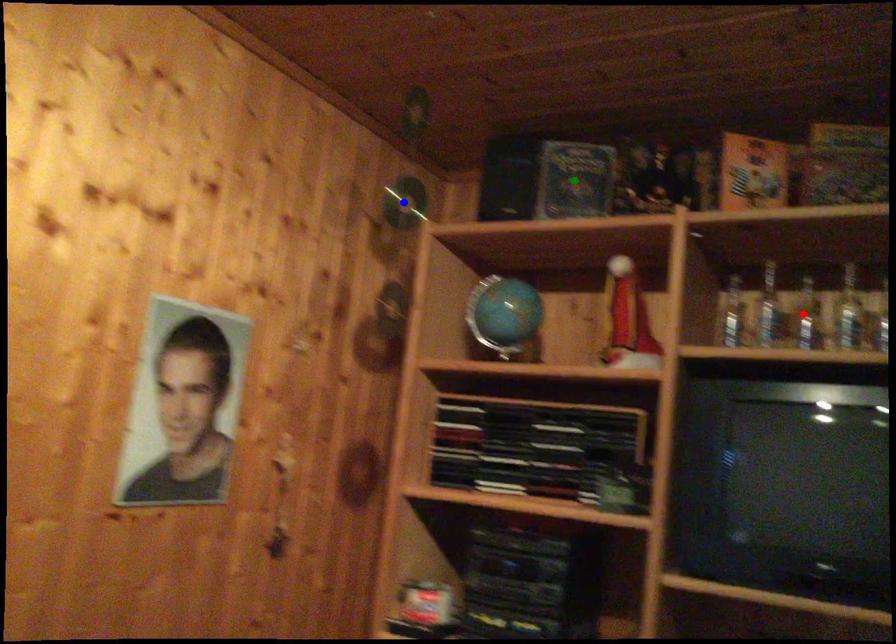
Based on the photo, order these from nearest to farthest:
green point, blue point, red point

blue point, green point, red point